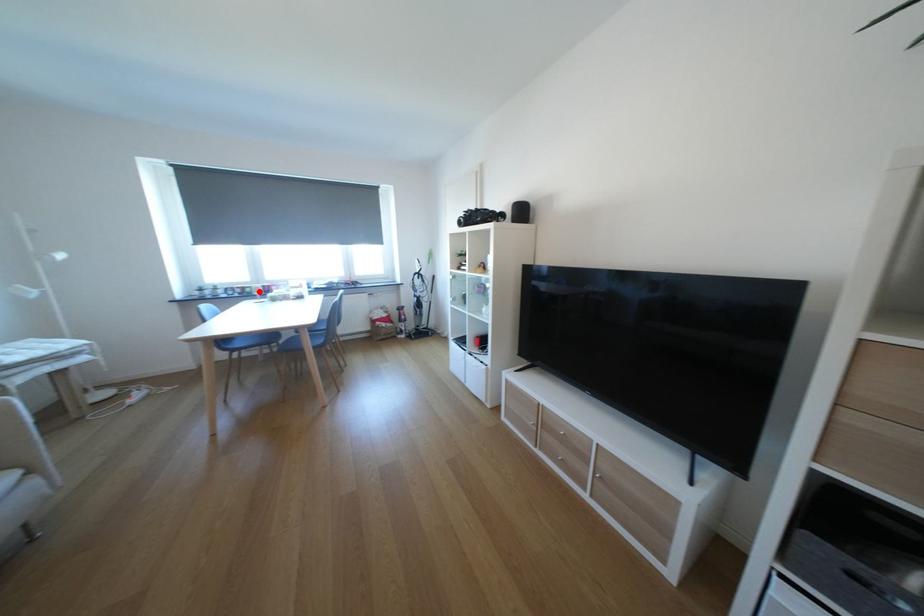
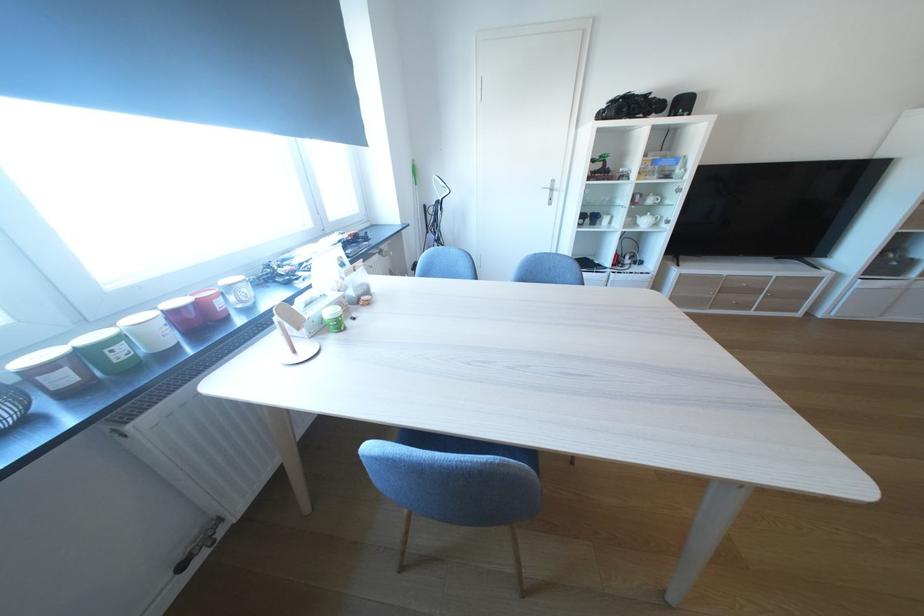
Where in the second image is the point corresponding to the highlighted location from the first image?

(129, 354)